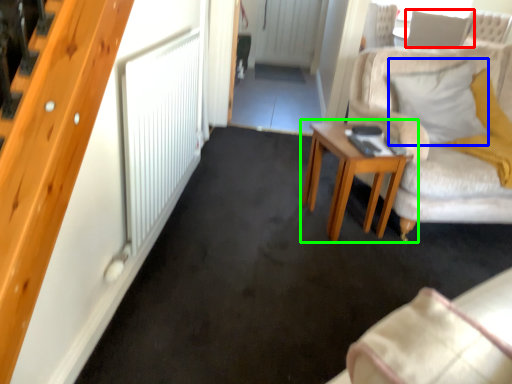
Question: Estimate the real-world distances between objects in this image. Which object is farther from pillow (highlighted by a red box), pillow (highlighted by a blue box) or table (highlighted by a green box)?

Choices:
 (A) pillow
 (B) table

Answer: (B)